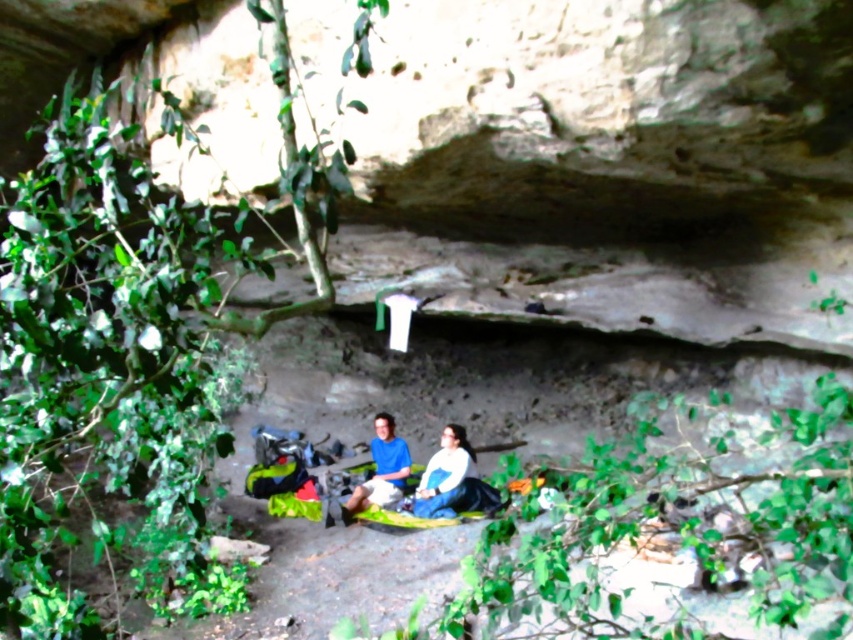
Is white matte jacket at center thinner than matte blue shirt at center?

No, white matte jacket at center is not thinner than matte blue shirt at center.

Is white matte jacket at center wider than matte blue shirt at center?

Yes.

Which is behind, point (462, 454) or point (386, 497)?

The point (462, 454) is behind.

The height and width of the screenshot is (640, 853). What are the coordinates of `white matte jacket at center` in the screenshot? It's located at (447, 477).